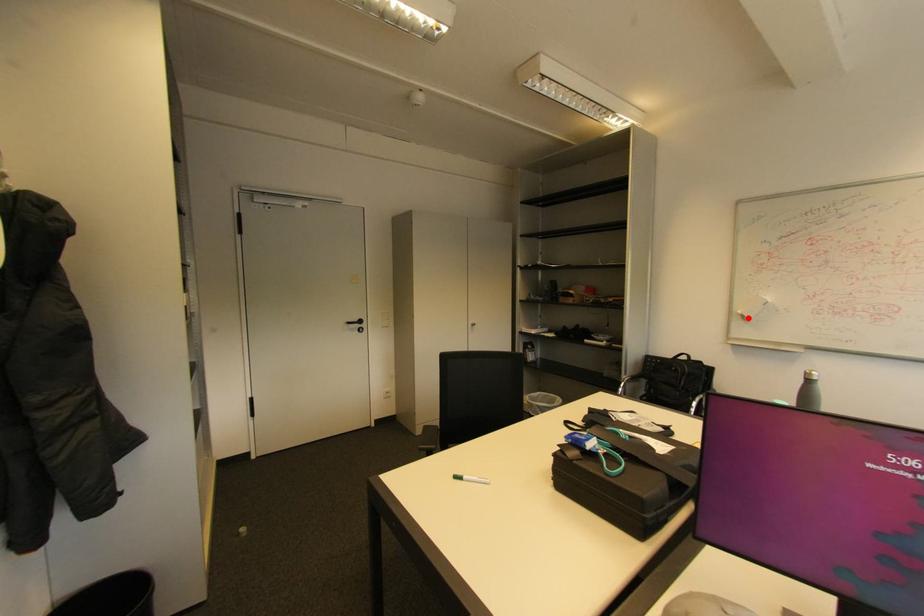
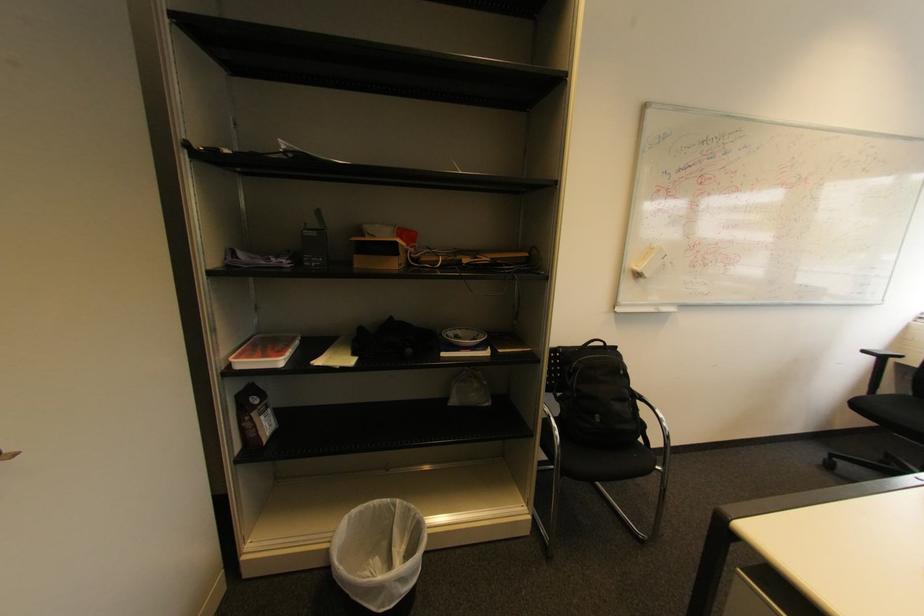
Find the pixel in the second image that matches the highlighted location in the first image.

(643, 276)